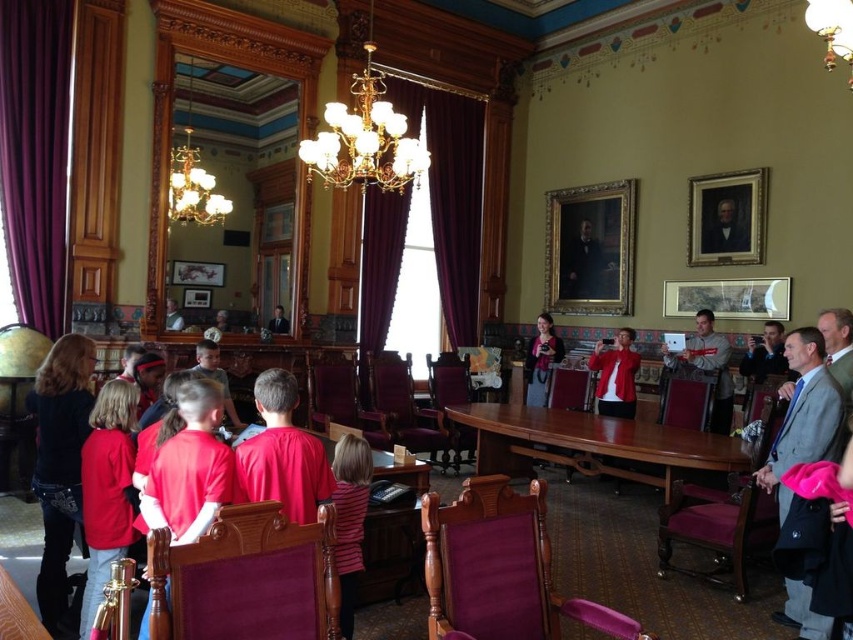
You are standing in the center of the formal room. Where is the gold metallic chandelier at upper center located in relation to your position?

The gold metallic chandelier at upper center is located at point 0.219 on the x axis and 0.429 on the y axis relative to your position in the center of the formal room.

You are a guest entering the formal room and notice two shirts on the table. The matte red shirt at center and the striped fabric shirt at lower center. Which shirt is taller?

The matte red shirt at center is taller than the striped fabric shirt at lower center.

You are attending a meeting in this formal room and notice two shirts on the table. The matte red shirt at center and the striped fabric shirt at lower center. Which shirt is positioned higher on the table?

The matte red shirt at center is positioned higher on the table than the striped fabric shirt at lower center.